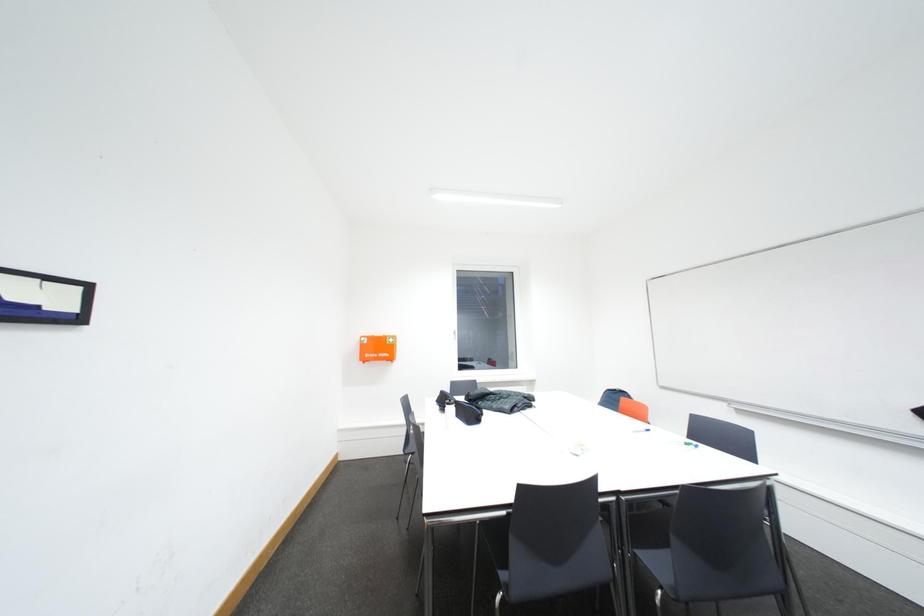
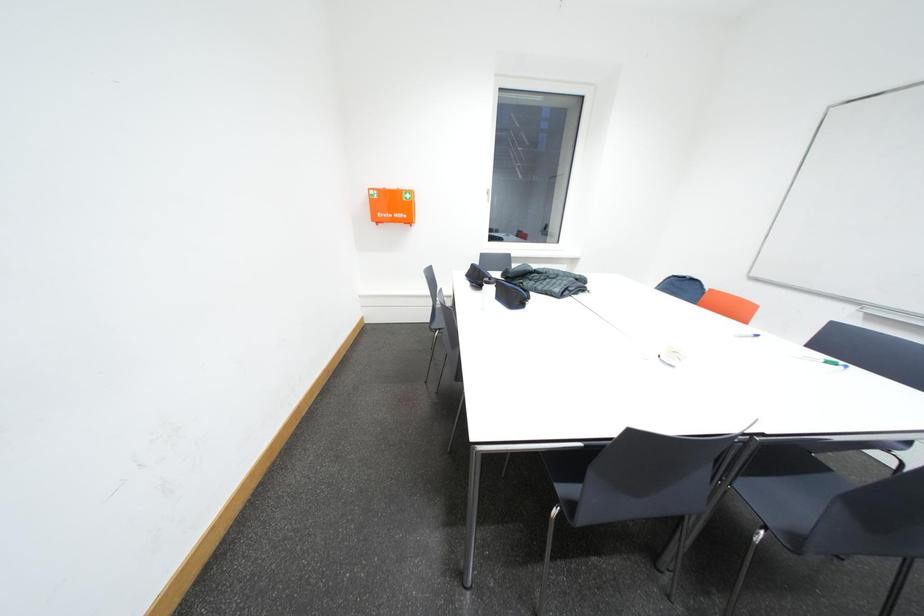
Question: In a continuous first-person perspective shot, in which direction is the camera moving?

Choices:
 (A) Left
 (B) Right
 (C) Forward
 (D) Backward

Answer: (C)